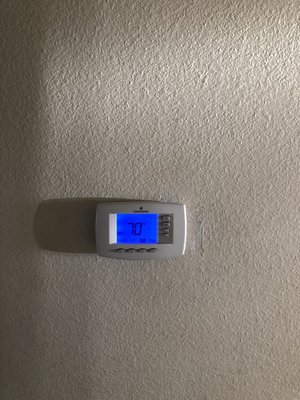
Find the location of `wall`. wall is located at coordinates (262, 340).